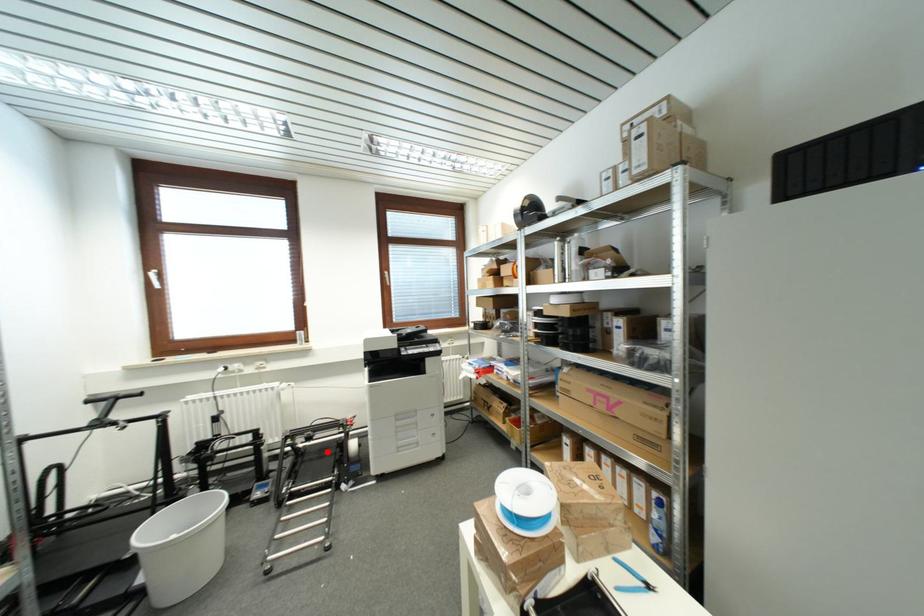
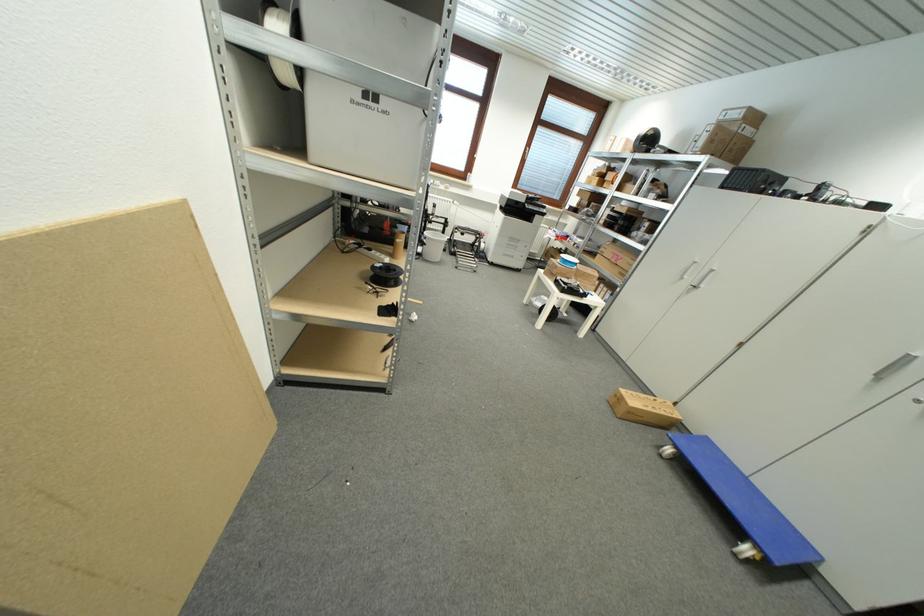
Question: A red point is marked in image1. In image2, is the corresponding 3D point closer to the camera or farther? Reply with the corresponding letter.

Choices:
 (A) The corresponding 3D point is closer.
 (B) The corresponding 3D point is farther.

Answer: (A)